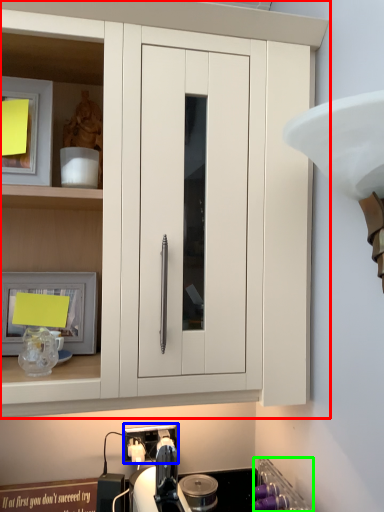
Question: Estimate the real-world distances between objects in this image. Which object is closer to cabinetry (highlighted by a red box), electric outlet (highlighted by a blue box) or appliance (highlighted by a green box)?

Choices:
 (A) electric outlet
 (B) appliance

Answer: (B)